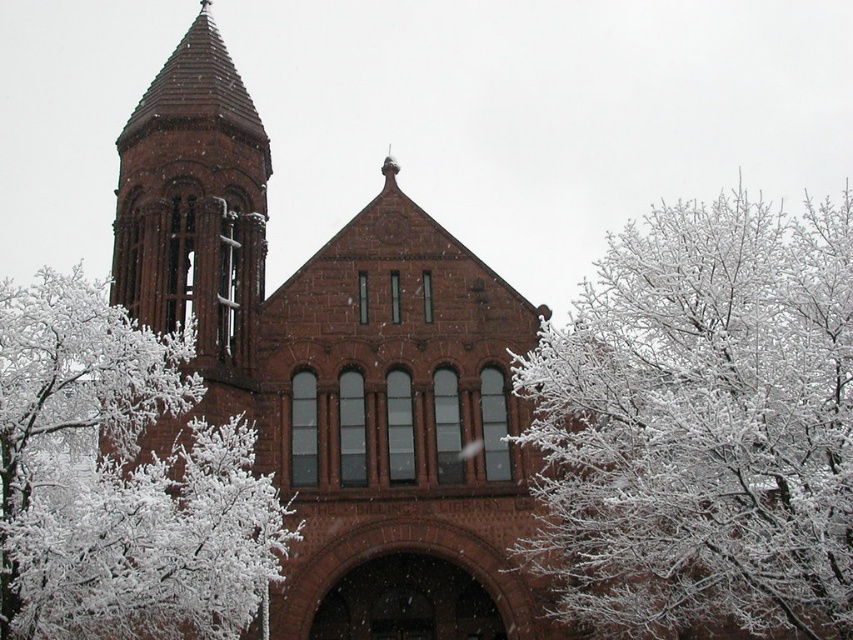
Who is positioned more to the right, white frosty branches at upper right or white frosty branches at center?

Positioned to the right is white frosty branches at upper right.

Who is taller, white frosty branches at upper right or white frosty branches at center?

white frosty branches at upper right

Between point (817, 429) and point (77, 496), which one is positioned in front?

Point (77, 496) is more forward.

This screenshot has height=640, width=853. What are the coordinates of `white frosty branches at upper right` in the screenshot? It's located at (701, 426).

Does white frosty branches at upper right appear on the left side of matte brick tower at upper left?

Incorrect, white frosty branches at upper right is not on the left side of matte brick tower at upper left.

Does point (581, 454) come in front of point (212, 140)?

Yes, it is in front of point (212, 140).

Find the location of `white frosty branches at upper right`. white frosty branches at upper right is located at coordinates (701, 426).

Is point (157, 486) less distant than point (158, 113)?

Yes, point (157, 486) is in front of point (158, 113).

You are a GUI agent. You are given a task and a screenshot of the screen. Output one action in this format:
    pyautogui.click(x=<x>, y=<y>)
    Task: Click on the white frosty branches at center
    Image resolution: width=853 pixels, height=640 pixels.
    Given the screenshot: What is the action you would take?
    pyautogui.click(x=120, y=481)